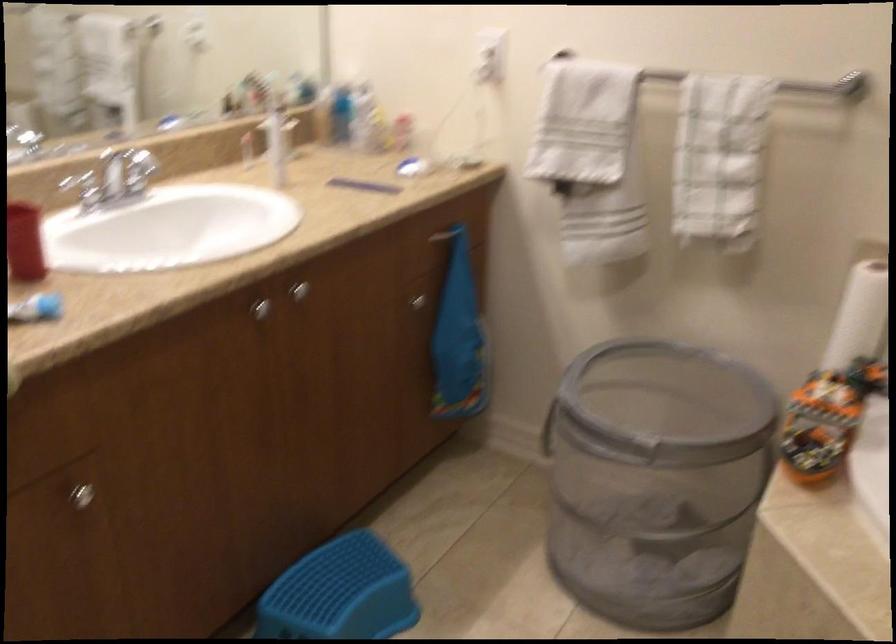
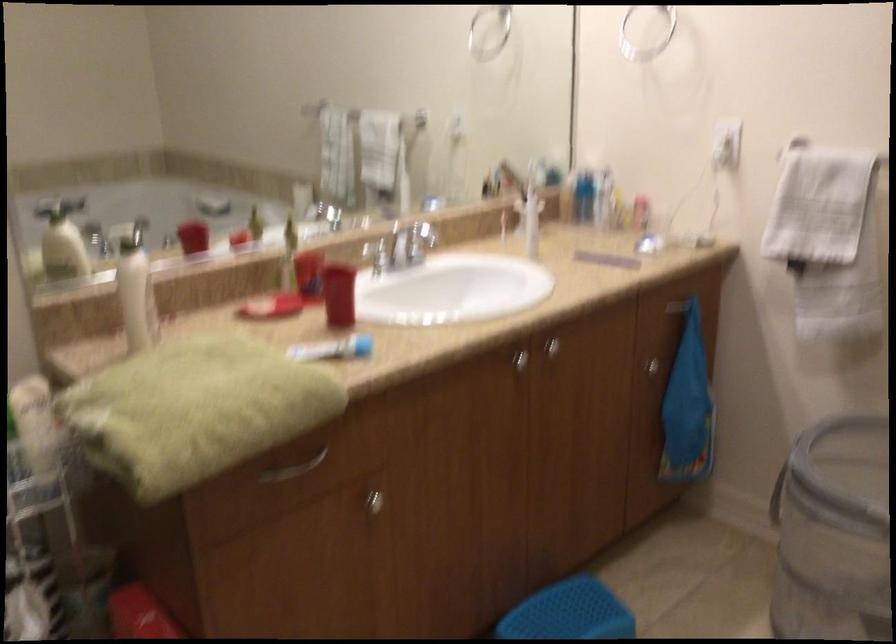
The point at (418, 301) is marked in the first image. Where is the corresponding point in the second image?

(650, 366)